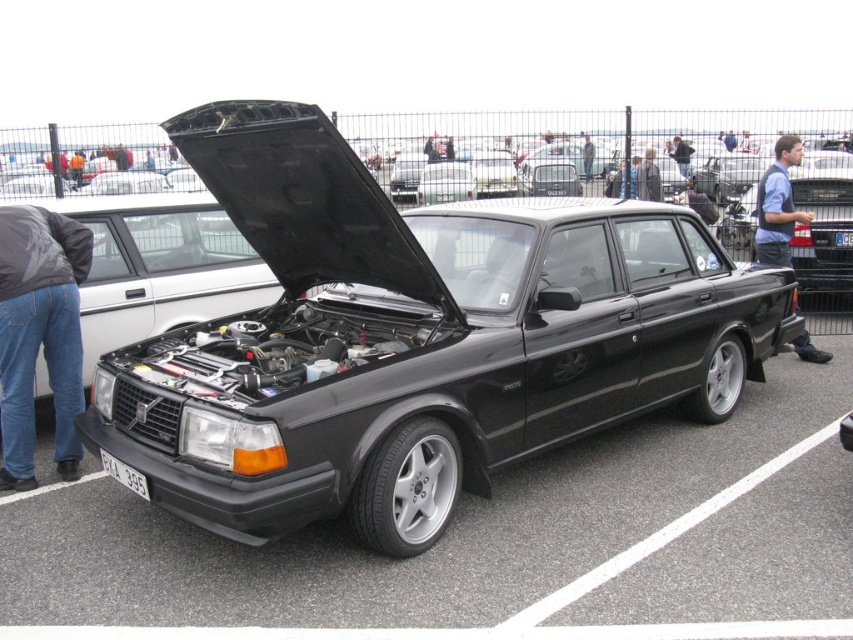
Is point (811, 355) positioned behind point (834, 234)?

No.

Between denim vest at right and white plastic license plate at center, which one is positioned higher?

denim vest at right

Between point (793, 211) and point (851, 230), which one is positioned behind?

The point (851, 230) is more distant.

Where is `denim vest at right`? denim vest at right is located at coordinates (778, 205).

Is point (135, 490) farther from camera compared to point (846, 234)?

No, (135, 490) is closer to viewer.

Which is below, white plastic license plate at lower center or white plastic license plate at center?

white plastic license plate at lower center is below.

Between point (137, 476) and point (848, 237), which one is positioned in front?

Point (137, 476)

The image size is (853, 640). Identify the location of white plastic license plate at lower center. (125, 474).

Does denim jeans at lower left have a greater height compared to white plastic license plate at center?

Correct, denim jeans at lower left is much taller as white plastic license plate at center.

The image size is (853, 640). In order to click on denim jeans at lower left in this screenshot , I will do `click(39, 333)`.

You are a GUI agent. You are given a task and a screenshot of the screen. Output one action in this format:
    pyautogui.click(x=<x>, y=<y>)
    Task: Click on the denim jeans at lower left
    
    Given the screenshot: What is the action you would take?
    pyautogui.click(x=39, y=333)